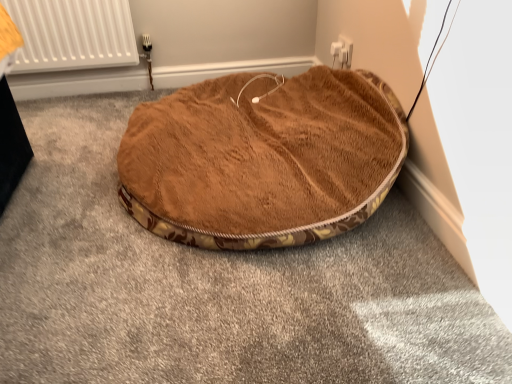
Describe the element at coordinates (263, 158) in the screenshot. I see `brown plush dog bed at center` at that location.

I want to click on brown plush dog bed at center, so click(263, 158).

The image size is (512, 384). Describe the element at coordinates (342, 52) in the screenshot. I see `white plastic electric outlet at upper center` at that location.

Measure the distance between point (342, 66) and camera.

1.78 meters.

I want to click on white plastic electric outlet at upper center, so click(x=342, y=52).

The image size is (512, 384). In order to click on brown plush dog bed at center in this screenshot , I will do point(263,158).

Can you confirm if white plastic electric outlet at upper center is positioned to the right of brown plush dog bed at center?

Correct, you'll find white plastic electric outlet at upper center to the right of brown plush dog bed at center.

Is white plastic electric outlet at upper center positioned behind brown plush dog bed at center?

Yes, the depth of white plastic electric outlet at upper center is greater than that of brown plush dog bed at center.

Considering the points (351, 51) and (206, 174), which point is behind, point (351, 51) or point (206, 174)?

Point (351, 51)

From the image's perspective, between white plastic electric outlet at upper center and brown plush dog bed at center, which one is located above?

white plastic electric outlet at upper center, from the image's perspective.

From a real-world perspective, is white plastic electric outlet at upper center on brown plush dog bed at center?

Indeed, from a real-world perspective, white plastic electric outlet at upper center stands above brown plush dog bed at center.

Which object is wider, white plastic electric outlet at upper center or brown plush dog bed at center?

Wider between the two is brown plush dog bed at center.

Considering the sizes of white plastic electric outlet at upper center and brown plush dog bed at center in the image, is white plastic electric outlet at upper center taller or shorter than brown plush dog bed at center?

In the image, white plastic electric outlet at upper center appears to be shorter than brown plush dog bed at center.

Based on the photo, does white plastic electric outlet at upper center have a larger size compared to brown plush dog bed at center?

Actually, white plastic electric outlet at upper center might be smaller than brown plush dog bed at center.

Is brown plush dog bed at center inside white plastic electric outlet at upper center?

No.

Consider the image. Is white plastic electric outlet at upper center with brown plush dog bed at center?

white plastic electric outlet at upper center is not next to brown plush dog bed at center, and they're not touching.

Is white plastic electric outlet at upper center aimed at brown plush dog bed at center?

Yes, white plastic electric outlet at upper center faces towards brown plush dog bed at center.

What's the angular difference between white plastic electric outlet at upper center and brown plush dog bed at center's facing directions?

The angular difference between white plastic electric outlet at upper center and brown plush dog bed at center is 0.181 degrees.

The height and width of the screenshot is (384, 512). What are the coordinates of `dog bed in front of the white plastic electric outlet at upper center` in the screenshot? It's located at (263, 158).

Which object is positioned more to the right, brown plush dog bed at center or white plastic electric outlet at upper center?

From the viewer's perspective, white plastic electric outlet at upper center appears more on the right side.

Is brown plush dog bed at center further to camera compared to white plastic electric outlet at upper center?

No, brown plush dog bed at center is closer to the viewer.

Considering the positions of points (279, 139) and (348, 58), is point (279, 139) closer to camera compared to point (348, 58)?

Yes.

From the image's perspective, is brown plush dog bed at center below white plastic electric outlet at upper center?

Indeed, from the image's perspective, brown plush dog bed at center is shown beneath white plastic electric outlet at upper center.

Based on the photo, from a real-world perspective, who is located higher, brown plush dog bed at center or white plastic electric outlet at upper center?

From a 3D spatial view, white plastic electric outlet at upper center is above.

Considering the relative sizes of brown plush dog bed at center and white plastic electric outlet at upper center in the image provided, is brown plush dog bed at center wider than white plastic electric outlet at upper center?

Correct, the width of brown plush dog bed at center exceeds that of white plastic electric outlet at upper center.

Can you confirm if brown plush dog bed at center is taller than white plastic electric outlet at upper center?

Yes.

Can you confirm if brown plush dog bed at center is bigger than white plastic electric outlet at upper center?

Yes, brown plush dog bed at center is bigger than white plastic electric outlet at upper center.

Would you say brown plush dog bed at center contains white plastic electric outlet at upper center?

Actually, white plastic electric outlet at upper center is outside brown plush dog bed at center.

Is brown plush dog bed at center in contact with white plastic electric outlet at upper center?

brown plush dog bed at center and white plastic electric outlet at upper center are clearly separated.

Is brown plush dog bed at center facing towards white plastic electric outlet at upper center?

No, brown plush dog bed at center is not turned towards white plastic electric outlet at upper center.

You are a GUI agent. You are given a task and a screenshot of the screen. Output one action in this format:
    pyautogui.click(x=<x>, y=<y>)
    Task: Click on the electric outlet behind the brown plush dog bed at center
    
    Given the screenshot: What is the action you would take?
    pyautogui.click(x=342, y=52)

The height and width of the screenshot is (384, 512). I want to click on dog bed below the white plastic electric outlet at upper center (from the image's perspective), so click(263, 158).

Where is `dog bed in front of the white plastic electric outlet at upper center`? The image size is (512, 384). dog bed in front of the white plastic electric outlet at upper center is located at coordinates (263, 158).